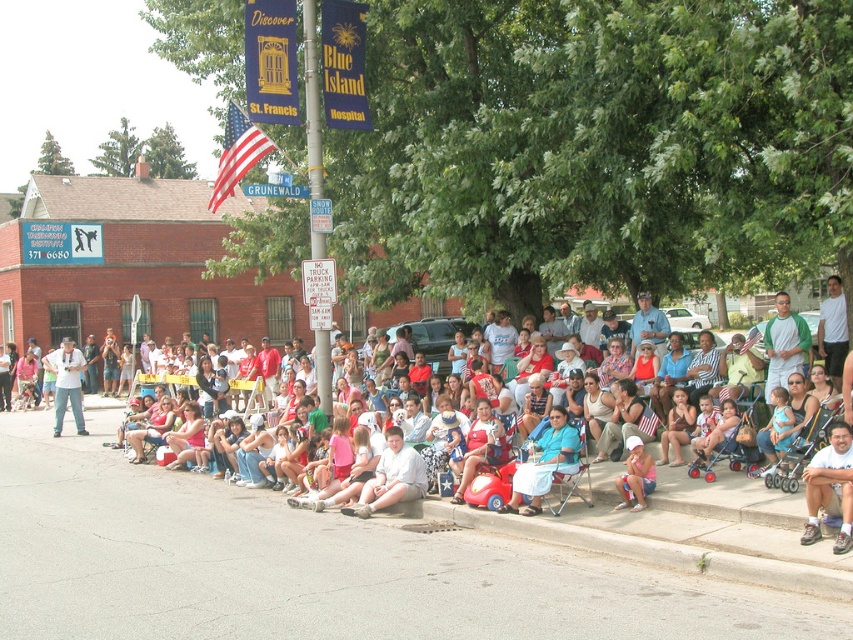
Question: Does light blue denim shorts at lower right appear under matte white camera at left?

Choices:
 (A) yes
 (B) no

Answer: (A)

Question: Among these points, which one is farthest from the camera?

Choices:
 (A) tap(462, 490)
 (B) tap(498, 512)
 (C) tap(399, 499)

Answer: (C)

Question: Which of these objects is positioned closest to the white cotton dress at center?

Choices:
 (A) light blue denim shorts at lower right
 (B) pink fabric dress at lower center

Answer: (B)

Question: Based on their relative distances, which object is nearer to the matte red car at center?

Choices:
 (A) matte white camera at left
 (B) light brown shorts at center
 (C) matte white shirt at center

Answer: (B)

Question: Is matte white shirt at center behind matte red car at center?

Choices:
 (A) yes
 (B) no

Answer: (B)

Question: Is light brown shorts at center to the left of matte red car at center from the viewer's perspective?

Choices:
 (A) yes
 (B) no

Answer: (A)